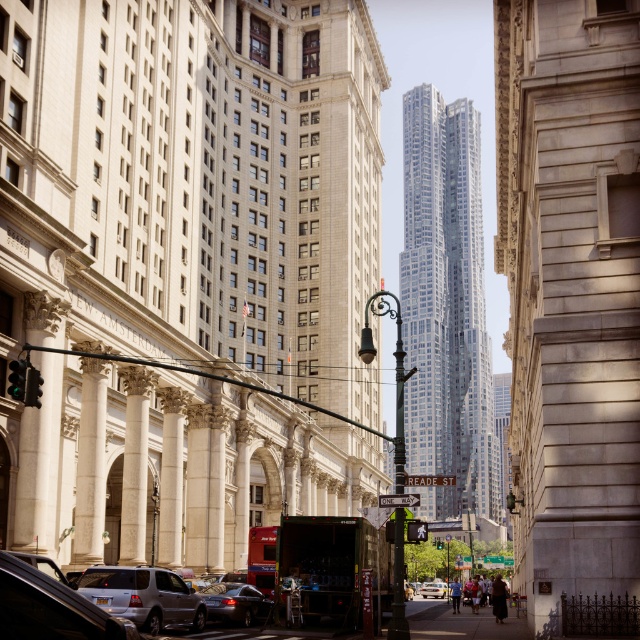
Question: Can you confirm if metallic traffic light at left is positioned below metallic rectangular traffic light at center?

Choices:
 (A) yes
 (B) no

Answer: (B)

Question: Does metallic red street sign at center appear on the right side of white plastic street sign at center?

Choices:
 (A) yes
 (B) no

Answer: (A)

Question: Which object is positioned closest to the shiny silver sedan at center?

Choices:
 (A) metallic traffic light at left
 (B) green glass traffic light at left
 (C) metallic rectangular traffic light at center

Answer: (C)

Question: Which is farther from the polished metal streetlight at center?

Choices:
 (A) metallic traffic light at left
 (B) white marble pillar at left

Answer: (A)

Question: Based on their relative distances, which object is nearer to the shiny black sedan at lower center?

Choices:
 (A) polished metal streetlight at center
 (B) silver metallic suv at lower left

Answer: (B)

Question: From the image, what is the correct spatial relationship of white marble pillar at left in relation to green plastic street sign at center?

Choices:
 (A) above
 (B) below

Answer: (A)